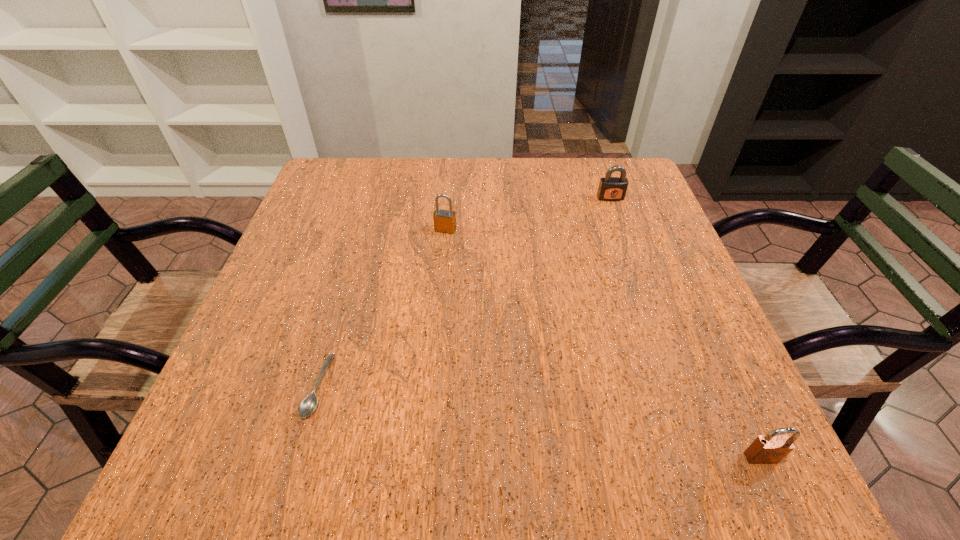
Where is `the second farthest padlock`? The image size is (960, 540). the second farthest padlock is located at coordinates (444, 220).

Image resolution: width=960 pixels, height=540 pixels. I want to click on the leftmost padlock, so click(x=444, y=220).

At what (x,y) coordinates should I click in order to perform the action: click on the farthest padlock. Please return your answer as a coordinate pair (x, y). The image size is (960, 540). Looking at the image, I should click on (610, 188).

Where is `the farthest object`? Image resolution: width=960 pixels, height=540 pixels. the farthest object is located at coordinates (610, 188).

Where is `the rightmost object`? This screenshot has height=540, width=960. the rightmost object is located at coordinates (772, 448).

Where is `the rightmost padlock`? the rightmost padlock is located at coordinates (772, 448).

This screenshot has width=960, height=540. I want to click on the leftmost object, so click(308, 405).

In order to click on the third farthest object in this screenshot , I will do `click(308, 405)`.

At what (x,y) coordinates should I click in order to perform the action: click on vacant point located on the back of the third object from right to left. Please return your answer as a coordinate pair (x, y). This screenshot has width=960, height=540. Looking at the image, I should click on (447, 210).

Locate an element on the screen. Image resolution: width=960 pixels, height=540 pixels. vacant space located on the front of the farthest padlock near the keyhole is located at coordinates (641, 285).